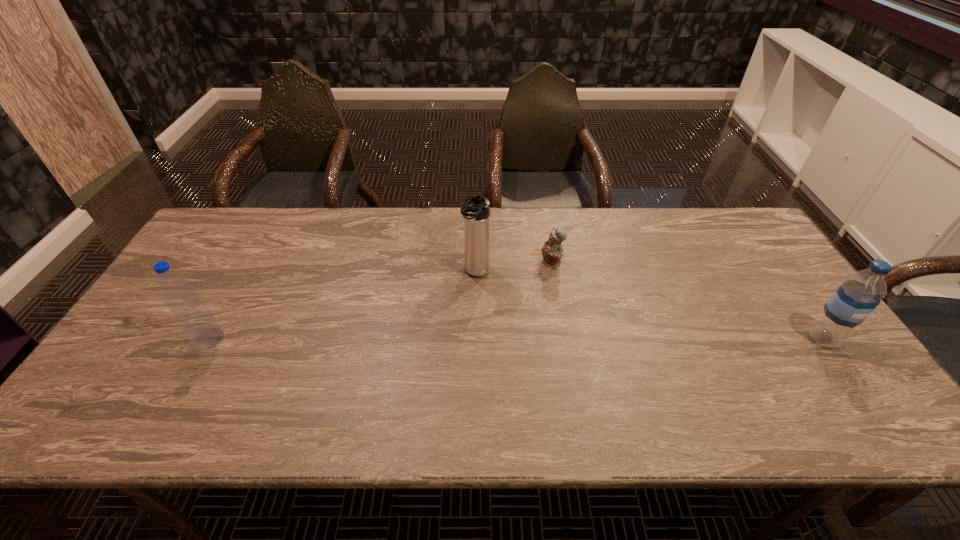
Where is `free spot on the desktop that is between the leftmost object and the right water bottle and is positioned on the front-facing side of the shortest object`? Image resolution: width=960 pixels, height=540 pixels. free spot on the desktop that is between the leftmost object and the right water bottle and is positioned on the front-facing side of the shortest object is located at coordinates (452, 339).

I want to click on vacant space on the desktop that is between the leftmost object and the rightmost object and is positioned on the handle side of the second object from left to right, so click(437, 339).